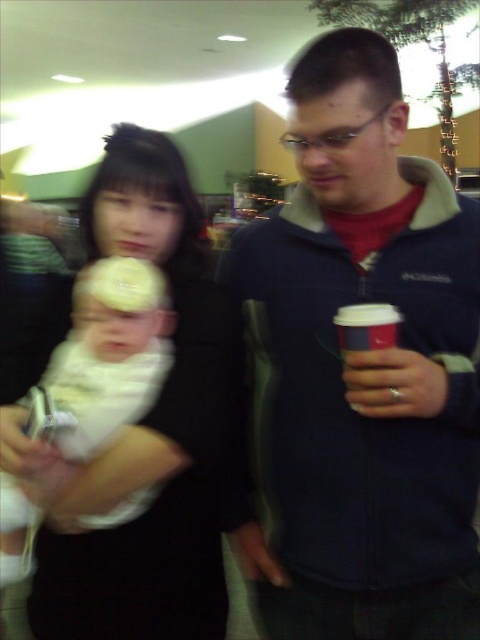
You are a photographer trying to capture a closeup of the white matte baby at center. The camera you are using has a minimum focusing distance of 30 inches. Will you be able to take the photo without moving closer?

The white matte baby at center is 29.42 inches away from the camera, which is less than the minimum focusing distance of 30 inches. Therefore, you cannot take the photo without moving further away or adjusting the camera settings.

In the scene shown: You are a photographer trying to capture a closeup of the white matte baby at center and the white paper cup at right. If you want to ensure both are fully visible in the frame, which object should you adjust your camera focus to prioritize in terms of size? Explain your reasoning based on their sizes.

The white matte baby at center is wider than the white paper cup at right. To ensure both are fully visible, prioritize focusing on the white matte baby at center since it requires more space due to its greater width.

You are a photographer trying to capture a closeup of the white matte baby at center and the white soft fabric baby at left. Can you fit both into your camera frame if your lens has a minimum focus distance of 3 inches?

The white matte baby at center and the white soft fabric baby at left are 3.18 inches apart. Since the minimum focus distance is 3 inches, the photographer can fit both into the frame as the distance between them is slightly more than the required minimum focus distance.